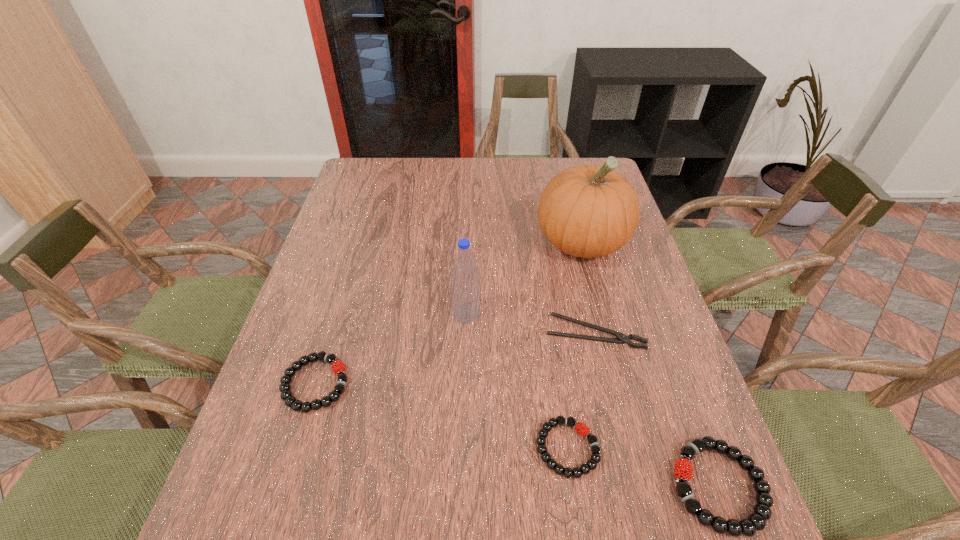
Image resolution: width=960 pixels, height=540 pixels. What are the coordinates of `the third nearest object` in the screenshot? It's located at click(x=338, y=367).

The width and height of the screenshot is (960, 540). I want to click on the second shortest bracelet, so click(x=338, y=367).

Where is `the second bracelet from right to left`? This screenshot has width=960, height=540. the second bracelet from right to left is located at coordinates (584, 431).

Find the location of `the rightmost bracelet`. the rightmost bracelet is located at coordinates (756, 521).

I want to click on tongs, so click(x=621, y=338).

At what (x,y) coordinates should I click in order to perform the action: click on water bottle. Please return your answer as a coordinate pair (x, y). This screenshot has width=960, height=540. Looking at the image, I should click on (465, 292).

Identify the location of the fifth shortest object. The height and width of the screenshot is (540, 960). (465, 292).

The width and height of the screenshot is (960, 540). I want to click on pumpkin, so click(587, 211).

The width and height of the screenshot is (960, 540). In order to click on the tallest object in this screenshot , I will do `click(587, 211)`.

You are a GUI agent. You are given a task and a screenshot of the screen. Output one action in this format:
    pyautogui.click(x=<x>, y=<y>)
    Task: Click on the free space located on the right of the second shortest bracelet
    
    Given the screenshot: What is the action you would take?
    pyautogui.click(x=492, y=383)